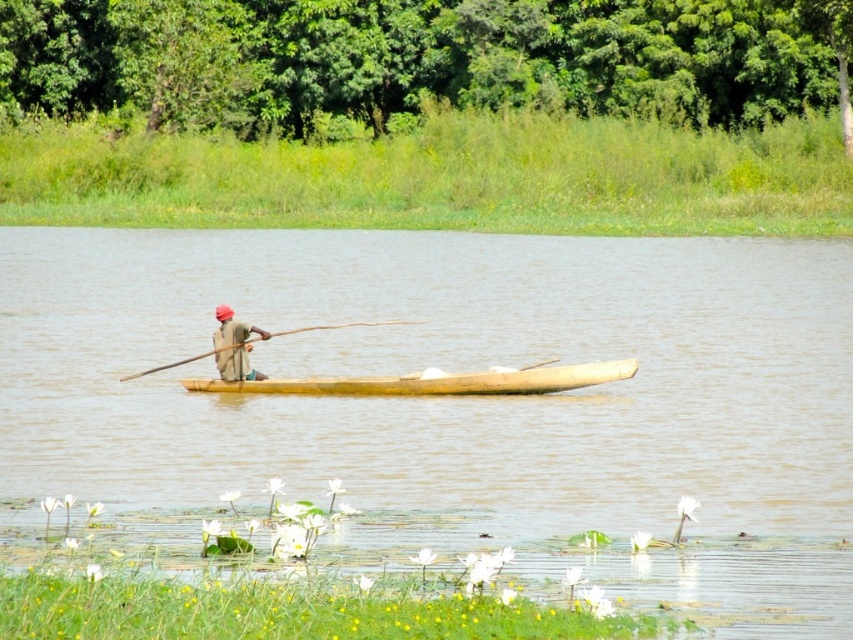
Question: Is matte brown canoe at center below wooden at center?

Choices:
 (A) no
 (B) yes

Answer: (B)

Question: Based on their relative distances, which object is farther from the wooden at center?

Choices:
 (A) brown wooden boat at center
 (B) light brown wooden canoe at center

Answer: (A)

Question: Which is farther from the wooden at center?

Choices:
 (A) light brown wooden canoe at center
 (B) brown wooden boat at center

Answer: (B)

Question: Is light brown wooden canoe at center smaller than matte brown canoe at center?

Choices:
 (A) yes
 (B) no

Answer: (B)

Question: Which of the following is the farthest from the observer?

Choices:
 (A) coord(729,426)
 (B) coord(316,330)
 (C) coord(229,381)
 (D) coord(242,372)

Answer: (B)

Question: Is matte brown canoe at center further to camera compared to wooden at center?

Choices:
 (A) no
 (B) yes

Answer: (B)